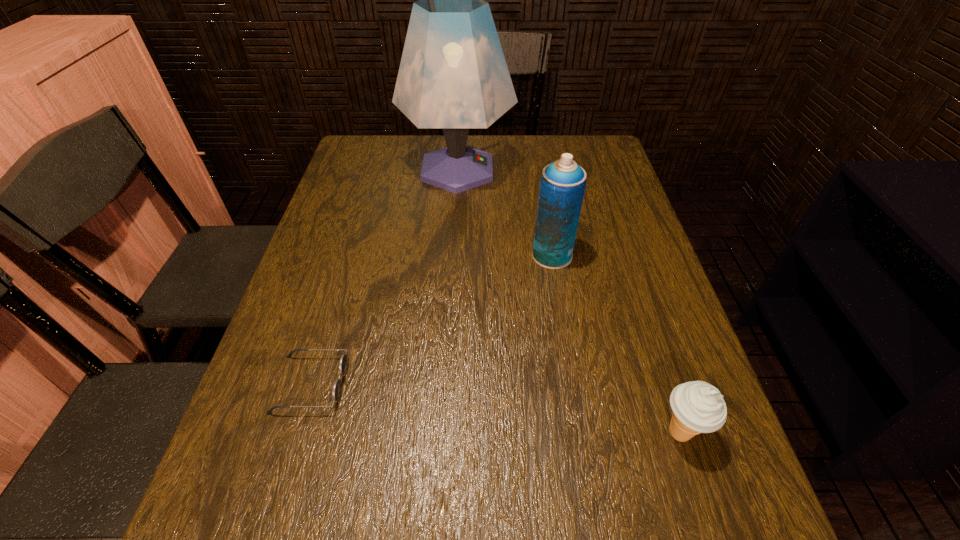
Image resolution: width=960 pixels, height=540 pixels. Find the location of `the second object from left to right`. the second object from left to right is located at coordinates (453, 75).

Find the location of a particular element. Image resolution: width=960 pixels, height=540 pixels. the tallest object is located at coordinates (453, 75).

Where is `the second tallest object`? Image resolution: width=960 pixels, height=540 pixels. the second tallest object is located at coordinates (562, 185).

Identify the location of aerosol can. (562, 185).

At what (x,y) coordinates should I click in order to perform the action: click on the rightmost object. Please return your answer as a coordinate pair (x, y). The width and height of the screenshot is (960, 540). Looking at the image, I should click on (698, 407).

Where is `the third tallest object`? the third tallest object is located at coordinates (698, 407).

This screenshot has height=540, width=960. I want to click on sunglasses, so click(x=343, y=363).

Identify the location of the leftmost object. (343, 363).

Find the location of a particular element. The height and width of the screenshot is (540, 960). free space located on the base of the lampshade is located at coordinates (611, 170).

I want to click on vacant space situated 0.170m on the right of the aerosol can, so click(640, 255).